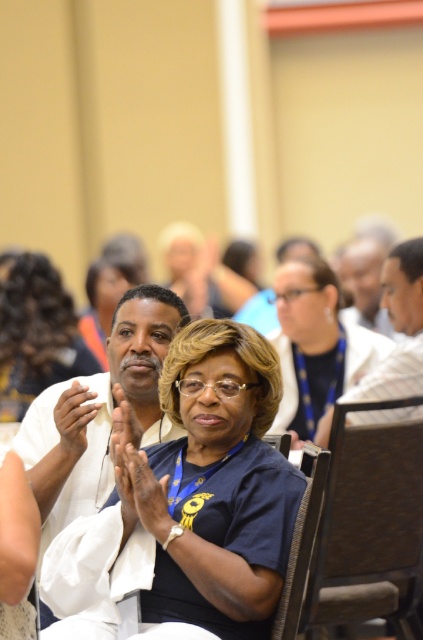
Question: Which object is closer to the camera taking this photo?

Choices:
 (A) matte black hair at left
 (B) brown woven chair at center

Answer: (B)

Question: Is white fabric shirt at center below matte black hair at left?

Choices:
 (A) no
 (B) yes

Answer: (B)

Question: Does blue fabric shirt at center have a greater width compared to brown fabric chair at center-right?

Choices:
 (A) no
 (B) yes

Answer: (B)

Question: Among these objects, which one is farthest from the camera?

Choices:
 (A) matte white shirt at center
 (B) blue fabric shirt at center

Answer: (A)

Question: Among these objects, which one is nearest to the camera?

Choices:
 (A) white fabric shirt at center
 (B) matte black hair at left

Answer: (A)

Question: Does brown fabric chair at center-right have a lesser width compared to matte white shirt at center?

Choices:
 (A) no
 (B) yes

Answer: (A)